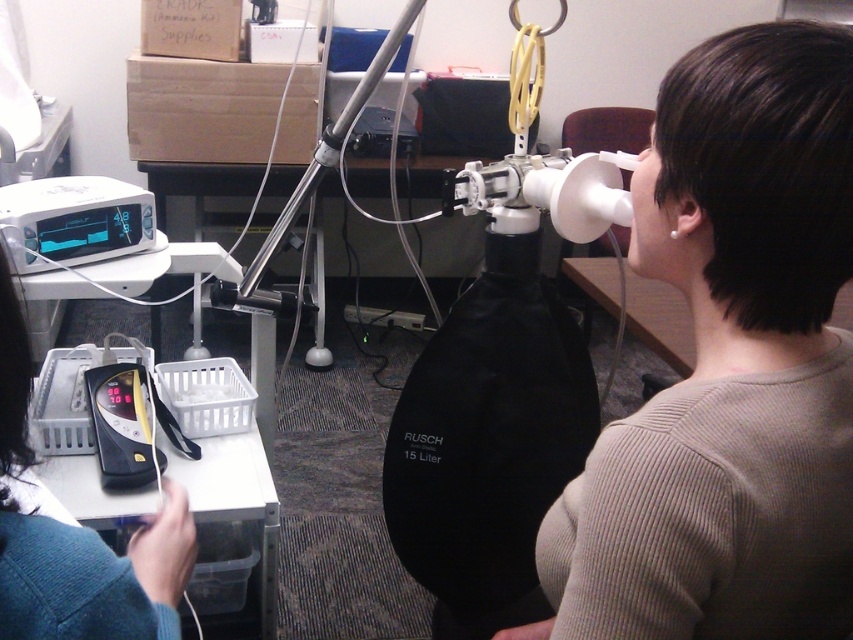
Question: Can you confirm if teal knit sweater at lower left is bigger than silver metallic tripod at center?

Choices:
 (A) no
 (B) yes

Answer: (A)

Question: Which object is the farthest from the silver metallic tripod at center?

Choices:
 (A) white plastic monitor at upper left
 (B) matte white mask at upper right

Answer: (B)

Question: Can you confirm if matte white mask at upper right is positioned to the left of white plastic monitor at upper left?

Choices:
 (A) yes
 (B) no

Answer: (B)

Question: Which object is the closest to the teal knit sweater at lower left?

Choices:
 (A) white plastic monitor at upper left
 (B) silver metallic tripod at center

Answer: (A)

Question: Is matte white mask at upper right thinner than white plastic monitor at upper left?

Choices:
 (A) yes
 (B) no

Answer: (B)

Question: Which object appears closest to the camera in this image?

Choices:
 (A) matte white mask at upper right
 (B) teal knit sweater at lower left
 (C) silver metallic tripod at center

Answer: (B)